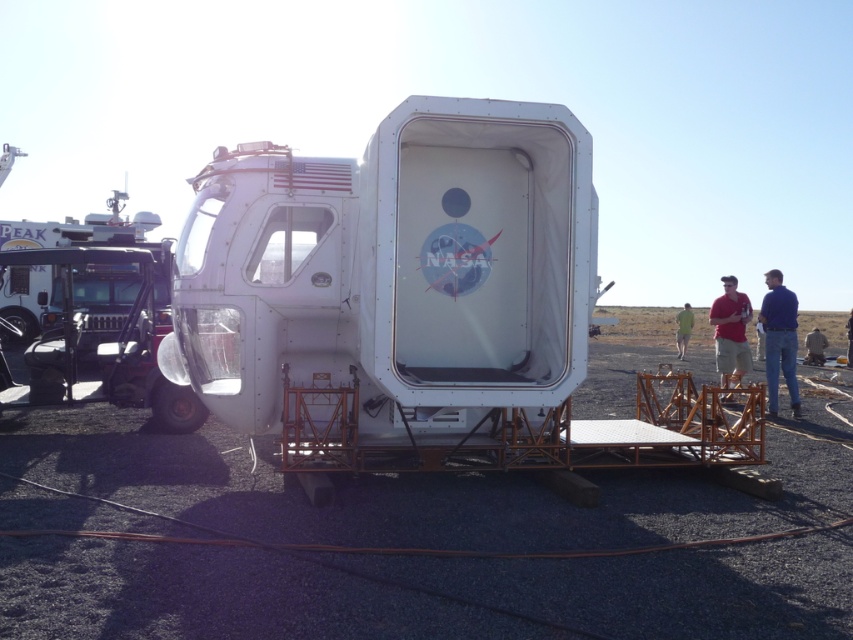
Between blue jeans at right and brown leather jacket at lower right, which one appears on the left side from the viewer's perspective?

Positioned to the left is blue jeans at right.

Does point (787, 381) come behind point (849, 332)?

That is False.

Which is in front, point (767, 305) or point (848, 337)?

Point (767, 305) is in front.

Identify the location of blue jeans at right. (779, 340).

Which is more to the right, blue jeans at right or green fabric shirt at center?

From the viewer's perspective, green fabric shirt at center appears more on the right side.

Is point (769, 387) more distant than point (686, 324)?

No, (769, 387) is closer to viewer.

Does point (790, 356) lie behind point (677, 339)?

No, (790, 356) is in front of (677, 339).

Where is `blue jeans at right`? This screenshot has height=640, width=853. blue jeans at right is located at coordinates (779, 340).

How distant is matte red shirt at center from brown leather jacket at lower right?

They are 11.17 meters apart.

This screenshot has width=853, height=640. Find the location of `matte red shirt at center`. matte red shirt at center is located at coordinates (730, 332).

Image resolution: width=853 pixels, height=640 pixels. What do you see at coordinates (730, 332) in the screenshot?
I see `matte red shirt at center` at bounding box center [730, 332].

This screenshot has width=853, height=640. What are the coordinates of `matte red shirt at center` in the screenshot? It's located at (730, 332).